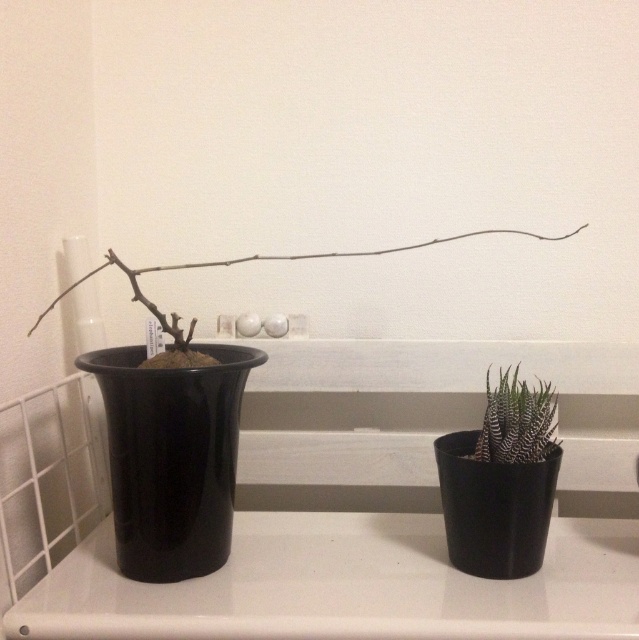
Question: Is the position of black glossy vase at lower right less distant than that of brown matte branch at center?

Choices:
 (A) yes
 (B) no

Answer: (B)

Question: Among these objects, which one is farthest from the camera?

Choices:
 (A) brown matte branch at center
 (B) glossy black vase at left
 (C) textured black pot at right
 (D) black glossy vase at lower right

Answer: (C)

Question: Which point is closer to the camera?

Choices:
 (A) textured black pot at right
 (B) brown matte branch at center

Answer: (B)

Question: Can you confirm if glossy black vase at left is wider than textured black pot at right?

Choices:
 (A) no
 (B) yes

Answer: (B)

Question: Which object is closer to the camera taking this photo?

Choices:
 (A) textured black pot at right
 (B) glossy black vase at left
 (C) black glossy vase at lower right

Answer: (B)

Question: Is black glossy vase at lower right behind brown matte branch at center?

Choices:
 (A) yes
 (B) no

Answer: (A)